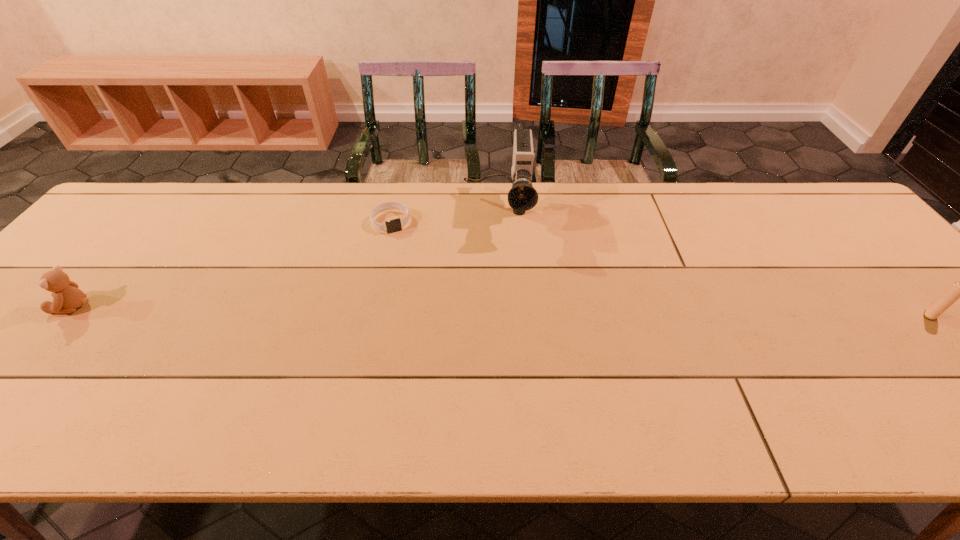
Image resolution: width=960 pixels, height=540 pixels. I want to click on free spot between the rightmost object and the tallest object, so click(713, 263).

Identify which object is the second nearest to the camcorder. Please provide its 2D coordinates. Your answer should be formatted as a tuple, i.e. [(x, y)], where the tuple contains the x and y coordinates of a point satisfying the conditions above.

[(67, 297)]

Point out which object is positioned as the nearest to the leftmost object. Please provide its 2D coordinates. Your answer should be formatted as a tuple, i.e. [(x, y)], where the tuple contains the x and y coordinates of a point satisfying the conditions above.

[(395, 225)]

You are a GUI agent. You are given a task and a screenshot of the screen. Output one action in this format:
    pyautogui.click(x=<x>, y=<y>)
    Task: Click on the vacant position in the image that satisfies the following two spatial constraints: 1. on the front side of the igniter; 2. on the left side of the third object from left to right
    
    Given the screenshot: What is the action you would take?
    pyautogui.click(x=501, y=315)

Where is `free space that satisfies the following two spatial constraints: 1. on the front side of the igniter; 2. on the right side of the camcorder`? The image size is (960, 540). free space that satisfies the following two spatial constraints: 1. on the front side of the igniter; 2. on the right side of the camcorder is located at coordinates (501, 315).

The height and width of the screenshot is (540, 960). I want to click on vacant point that satisfies the following two spatial constraints: 1. on the front side of the camcorder; 2. on the left side of the rightmost object, so click(501, 315).